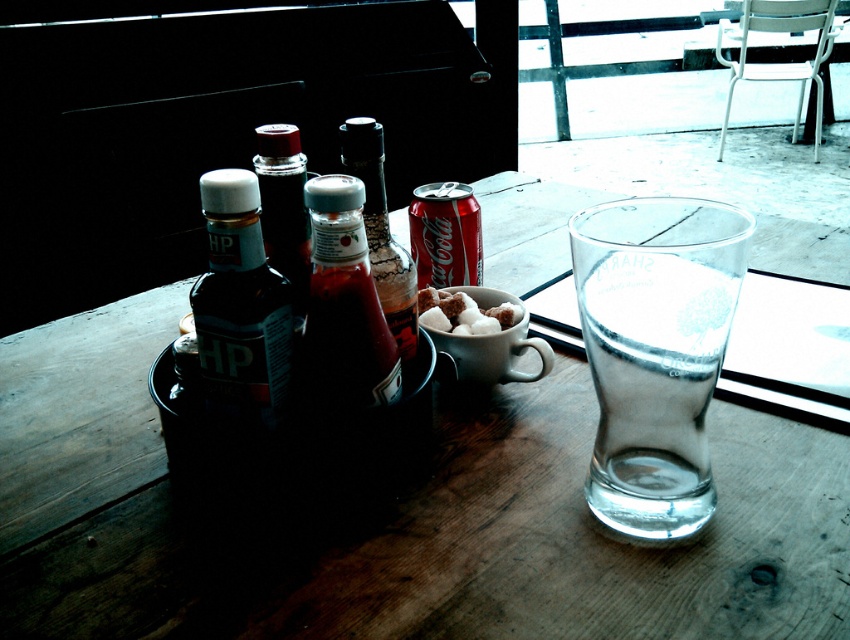
The image size is (850, 640). What do you see at coordinates (241, 305) in the screenshot?
I see `matte plastic hp sauce at left` at bounding box center [241, 305].

Who is shorter, matte plastic hp sauce at left or translucent glass bottle at center?

matte plastic hp sauce at left is shorter.

What do you see at coordinates (241, 305) in the screenshot?
I see `matte plastic hp sauce at left` at bounding box center [241, 305].

Identify the location of matte plastic hp sauce at left. (241, 305).

Does matte glass bottle at center appear on the right side of red matte coca-cola can at center?

Incorrect, matte glass bottle at center is not on the right side of red matte coca-cola can at center.

Which is above, matte glass bottle at center or red matte coca-cola can at center?

red matte coca-cola can at center is above.

Does point (301, 264) come closer to viewer compared to point (479, 220)?

Yes.

Locate an element on the screen. The image size is (850, 640). matte glass bottle at center is located at coordinates (284, 209).

Which is in front, point (683, 323) or point (506, 323)?

Point (683, 323) is in front.

Does point (604, 426) come farther from viewer compared to point (457, 307)?

That is False.

Locate an element on the screen. transparent glass at right is located at coordinates (653, 387).